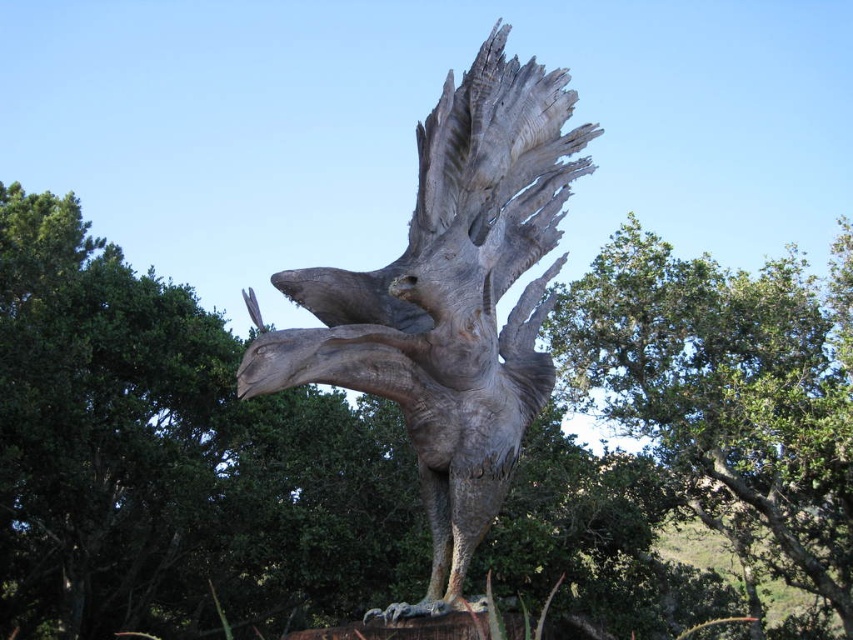
Question: Which object is farther from the camera taking this photo?

Choices:
 (A) green leafy tree at center
 (B) gray stone eagle at center

Answer: (A)

Question: Can you confirm if green leafy tree at center is wider than gray stone eagle at center?

Choices:
 (A) yes
 (B) no

Answer: (A)

Question: Is green leafy tree at center above gray stone eagle at center?

Choices:
 (A) no
 (B) yes

Answer: (A)

Question: Can you confirm if green leafy tree at center is thinner than gray stone eagle at center?

Choices:
 (A) yes
 (B) no

Answer: (B)